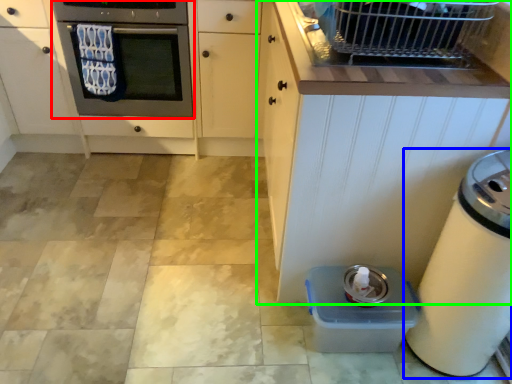
Question: Which object is the closest to the oven (highlighted by a red box)? Choose among these: home appliance (highlighted by a blue box) or cabinetry (highlighted by a green box).

Choices:
 (A) home appliance
 (B) cabinetry

Answer: (B)